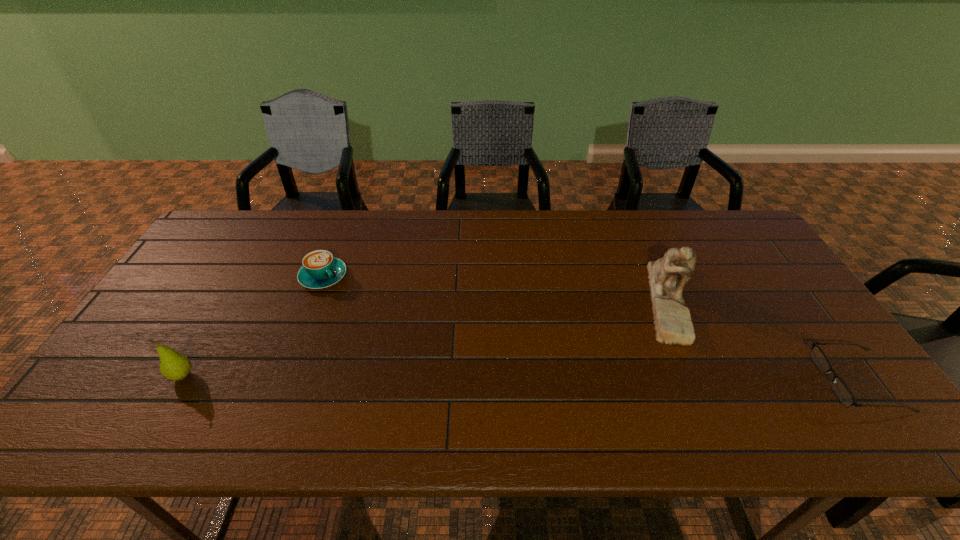
Where is `pear`? pear is located at coordinates (174, 366).

I want to click on the second tallest object, so click(x=174, y=366).

Find the location of `the shortest object`. the shortest object is located at coordinates (841, 390).

Find the location of a particular element. This screenshot has width=960, height=540. the rightmost object is located at coordinates (841, 390).

The image size is (960, 540). What are the coordinates of `the tallest object` in the screenshot? It's located at click(x=668, y=275).

Where is `the second object from right to left`? This screenshot has width=960, height=540. the second object from right to left is located at coordinates (668, 275).

Identify the location of the third tallest object. The height and width of the screenshot is (540, 960). (320, 269).

Locate an element on the screen. Image resolution: width=960 pixels, height=540 pixels. cappuccino is located at coordinates (320, 269).

Locate an element on the screen. The height and width of the screenshot is (540, 960). blank area located on the left of the leftmost object is located at coordinates (116, 376).

The width and height of the screenshot is (960, 540). Identify the location of vacant space located 0.350m on the front-facing side of the rightmost object. (680, 381).